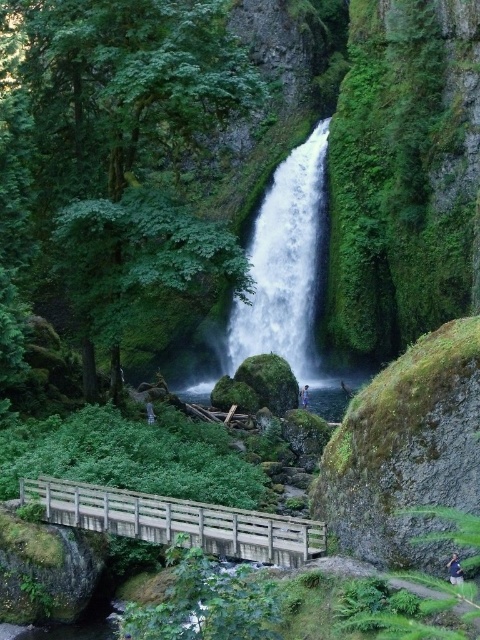
You are standing on the wooden bridge in the scene and notice two items near the edge. The green fabric shirt at center and the light blue denim jeans at center are both visible. If you want to pick up the closest item to you, which one should you choose?

The green fabric shirt at center is 35.94 meters away from the light blue denim jeans at center. Since you are on the bridge, the distance between them indicates that whichever is closer to your position would be the one to pick up. However, without knowing your exact location on the bridge, it is impossible to determine which item is nearer to you.

You are standing on the wooden bridge and see the white smooth waterfall at center and the green fabric shirt at center. Which object is higher in elevation?

The white smooth waterfall at center is higher in elevation than the green fabric shirt at center because it is positioned above it.

You are a hiker who wants to take a photo of the white smooth waterfall at center and the green fabric shirt at center in the same frame. Given that your camera has a maximum focal length that allows capturing objects up to 150 feet apart, will you be able to include both objects in a single photo?

The white smooth waterfall at center and green fabric shirt at center are 174.72 feet apart from each other, which exceeds the camera maximum focal length of 150 feet. Therefore, you cannot include both in a single photo.